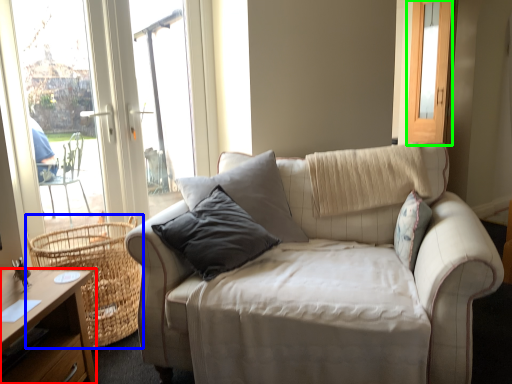
Question: Which is farther away from desk (highlighted by a red box)? basket (highlighted by a blue box) or screen door (highlighted by a green box)?

Choices:
 (A) basket
 (B) screen door

Answer: (B)